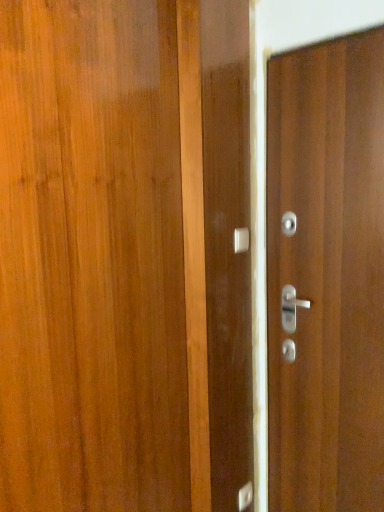
Question: Which direction should I rotate to face satin silver door handle at center, the 2th door handle ordered from the bottom, — up or down?

Choices:
 (A) down
 (B) up

Answer: (B)

Question: From the image's perspective, is satin silver door handle at center, acting as the 1th door handle starting from the bottom, below wooden door at right?

Choices:
 (A) no
 (B) yes

Answer: (B)

Question: From the image's perspective, is satin silver door handle at center, placed as the 2th door handle when sorted from front to back, on top of wooden door at right?

Choices:
 (A) no
 (B) yes

Answer: (A)

Question: Can you see satin silver door handle at center, acting as the 1th door handle starting from the bottom, touching wooden door at right?

Choices:
 (A) no
 (B) yes

Answer: (A)

Question: Is satin silver door handle at center, placed as the 2th door handle when sorted from front to back, oriented towards wooden door at right?

Choices:
 (A) no
 (B) yes

Answer: (A)

Question: From a real-world perspective, is satin silver door handle at center, placed as the first door handle when sorted from back to front, positioned over wooden door at right based on gravity?

Choices:
 (A) no
 (B) yes

Answer: (A)

Question: Is satin silver door handle at center, placed as the first door handle when sorted from back to front, smaller than wooden door at right?

Choices:
 (A) yes
 (B) no

Answer: (A)

Question: Is satin silver door handle at center, acting as the 1th door handle starting from the bottom, at the back of wooden door at right?

Choices:
 (A) yes
 (B) no

Answer: (B)

Question: Considering the relative positions of wooden door at right and satin silver door handle at center, placed as the first door handle when sorted from back to front, in the image provided, is wooden door at right in front of satin silver door handle at center, placed as the first door handle when sorted from back to front,?

Choices:
 (A) yes
 (B) no

Answer: (A)

Question: Is wooden door at right bigger than satin silver door handle at center, the second door handle viewed from the top?

Choices:
 (A) yes
 (B) no

Answer: (A)

Question: From a real-world perspective, is wooden door at right physically below satin silver door handle at center, placed as the first door handle when sorted from back to front?

Choices:
 (A) yes
 (B) no

Answer: (B)

Question: Is wooden door at right beside satin silver door handle at center, acting as the 1th door handle starting from the bottom?

Choices:
 (A) yes
 (B) no

Answer: (B)

Question: Would you say wooden door at right is a long distance from satin silver door handle at center, placed as the 2th door handle when sorted from front to back?

Choices:
 (A) no
 (B) yes

Answer: (A)

Question: Does satin silver door handle at center, the first door handle in the top-to-bottom sequence, lie in front of satin silver door handle at center, acting as the 1th door handle starting from the bottom?

Choices:
 (A) no
 (B) yes

Answer: (B)